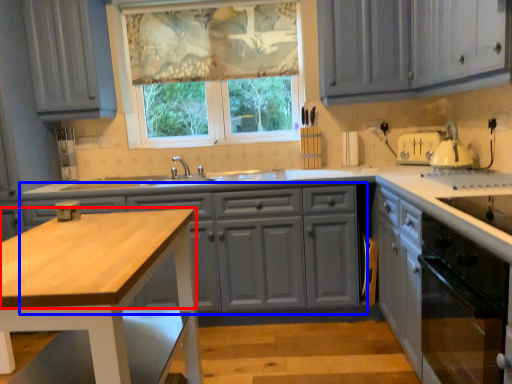
Question: Which object is further to the camera taking this photo, countertop (highlighted by a red box) or cabinetry (highlighted by a blue box)?

Choices:
 (A) countertop
 (B) cabinetry

Answer: (B)